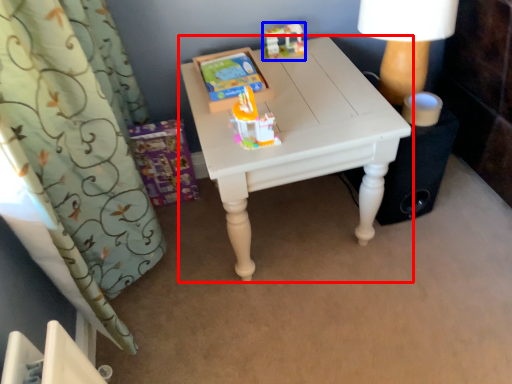
Question: Which of the following is the farthest to the observer, table (highlighted by a red box) or toy (highlighted by a blue box)?

Choices:
 (A) table
 (B) toy

Answer: (B)